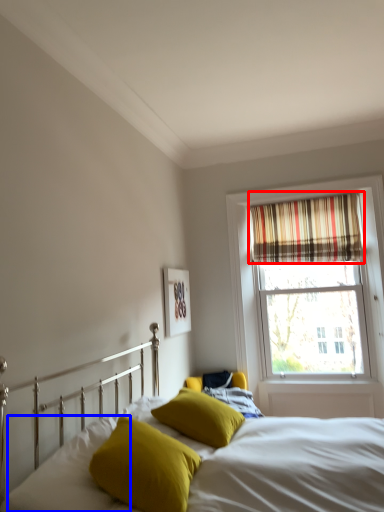
Question: Which of the following is the farthest to the observer, curtain (highlighted by a red box) or pillow (highlighted by a blue box)?

Choices:
 (A) curtain
 (B) pillow

Answer: (A)